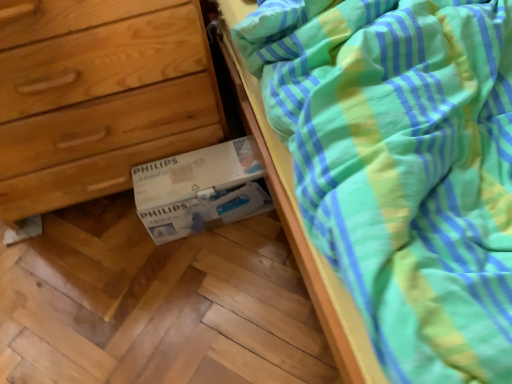
What do you see at coordinates (199, 190) in the screenshot?
I see `white cardboard box at lower center` at bounding box center [199, 190].

You are a GUI agent. You are given a task and a screenshot of the screen. Output one action in this format:
    pyautogui.click(x=<x>, y=<y>)
    Task: Click on the white cardboard box at lower center
    The width and height of the screenshot is (512, 384).
    Given the screenshot: What is the action you would take?
    pyautogui.click(x=199, y=190)

This screenshot has height=384, width=512. I want to click on wooden chest of drawers at lower left, so click(x=102, y=108).

The image size is (512, 384). Describe the element at coordinates (102, 108) in the screenshot. I see `wooden chest of drawers at lower left` at that location.

What is the approximate width of wooden chest of drawers at lower left?

wooden chest of drawers at lower left is 17.36 inches in width.

This screenshot has width=512, height=384. Identify the location of white cardboard box at lower center. (199, 190).

Does wooden chest of drawers at lower left appear on the left side of white cardboard box at lower center?

Indeed, wooden chest of drawers at lower left is positioned on the left side of white cardboard box at lower center.

Which object is more forward, wooden chest of drawers at lower left or white cardboard box at lower center?

wooden chest of drawers at lower left is more forward.

Is point (193, 114) positioned behind point (226, 176)?

No.

From the image's perspective, is wooden chest of drawers at lower left located beneath white cardboard box at lower center?

No.

From a real-world perspective, is wooden chest of drawers at lower left on white cardboard box at lower center?

Indeed, from a real-world perspective, wooden chest of drawers at lower left stands above white cardboard box at lower center.

In the scene shown: Looking at their sizes, would you say wooden chest of drawers at lower left is wider or thinner than white cardboard box at lower center?

Considering their sizes, wooden chest of drawers at lower left looks broader than white cardboard box at lower center.

From their relative heights in the image, would you say wooden chest of drawers at lower left is taller or shorter than white cardboard box at lower center?

In the image, wooden chest of drawers at lower left appears to be taller than white cardboard box at lower center.

Looking at the image, does wooden chest of drawers at lower left seem bigger or smaller compared to white cardboard box at lower center?

In the image, wooden chest of drawers at lower left appears to be larger than white cardboard box at lower center.

From the picture: Is wooden chest of drawers at lower left situated inside white cardboard box at lower center or outside?

wooden chest of drawers at lower left is not inside white cardboard box at lower center, it's outside.

Are wooden chest of drawers at lower left and white cardboard box at lower center located far from each other?

No, wooden chest of drawers at lower left is not far away from white cardboard box at lower center.

Could you tell me if wooden chest of drawers at lower left is turned towards white cardboard box at lower center?

Yes, wooden chest of drawers at lower left is turned towards white cardboard box at lower center.

In the scene shown: How different are the orientations of wooden chest of drawers at lower left and white cardboard box at lower center in degrees?

2.2 degrees.

Locate an element on the screen. Image resolution: width=512 pixels, height=384 pixels. cardboard box behind the wooden chest of drawers at lower left is located at coordinates (199, 190).

Is white cardboard box at lower center to the right of wooden chest of drawers at lower left from the viewer's perspective?

Indeed, white cardboard box at lower center is positioned on the right side of wooden chest of drawers at lower left.

Is white cardboard box at lower center further to the viewer compared to wooden chest of drawers at lower left?

Yes, white cardboard box at lower center is further from the camera.

Is point (246, 197) closer or farther from the camera than point (154, 149)?

Point (246, 197) is positioned closer to the camera compared to point (154, 149).

From the image's perspective, is white cardboard box at lower center over wooden chest of drawers at lower left?

No, from the image's perspective, white cardboard box at lower center is not above wooden chest of drawers at lower left.

From a real-world perspective, which is physically above, white cardboard box at lower center or wooden chest of drawers at lower left?

wooden chest of drawers at lower left.

Which object is thinner, white cardboard box at lower center or wooden chest of drawers at lower left?

With smaller width is white cardboard box at lower center.

Between white cardboard box at lower center and wooden chest of drawers at lower left, which one has more height?

Standing taller between the two is wooden chest of drawers at lower left.

Who is smaller, white cardboard box at lower center or wooden chest of drawers at lower left?

Smaller between the two is white cardboard box at lower center.

Is wooden chest of drawers at lower left completely or partially inside white cardboard box at lower center?

That's incorrect, wooden chest of drawers at lower left is not inside white cardboard box at lower center.

Is white cardboard box at lower center placed right next to wooden chest of drawers at lower left?

No, white cardboard box at lower center is not beside wooden chest of drawers at lower left.

Is white cardboard box at lower center aimed at wooden chest of drawers at lower left?

No, white cardboard box at lower center is not aimed at wooden chest of drawers at lower left.

Locate an element on the screen. cardboard box below the wooden chest of drawers at lower left (from the image's perspective) is located at coordinates (199, 190).

This screenshot has height=384, width=512. What are the coordinates of `cardboard box that appears below the wooden chest of drawers at lower left (from the image's perspective)` in the screenshot? It's located at (199, 190).

Image resolution: width=512 pixels, height=384 pixels. I want to click on cardboard box on the right of the wooden chest of drawers at lower left, so click(x=199, y=190).